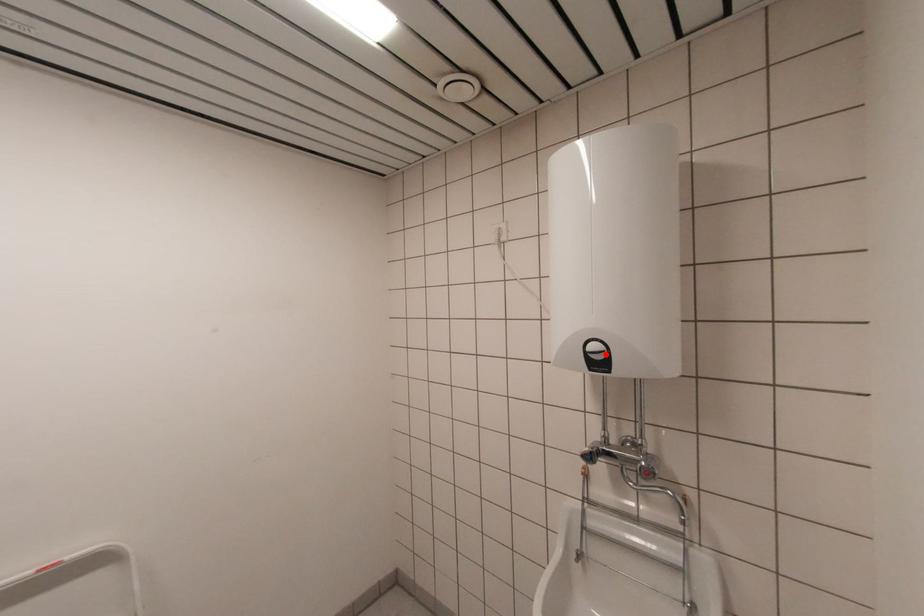
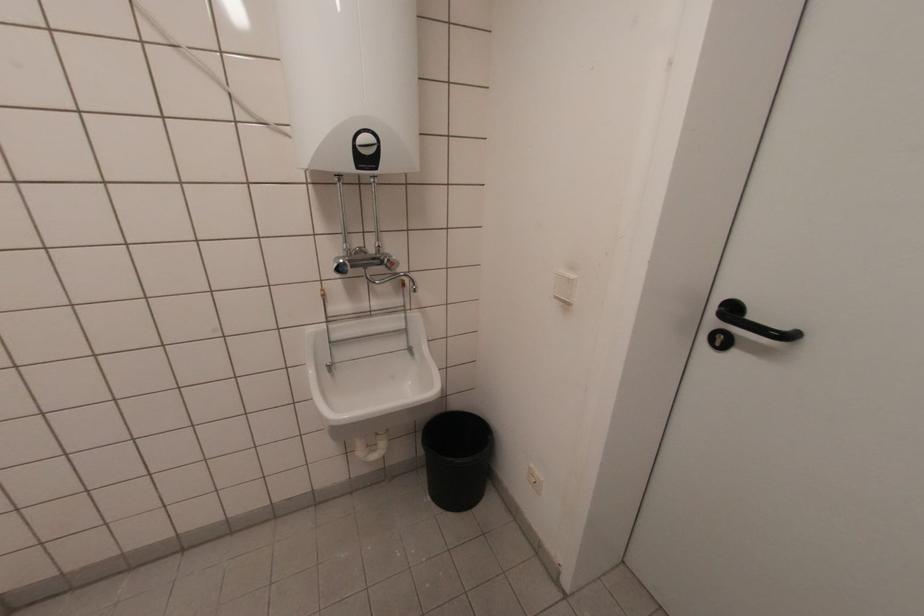
Question: I am providing you with two images of the same scene from different viewpoints. A red point is marked on the first image. Can you still see the location of the red point in image 2?

Choices:
 (A) Yes
 (B) No

Answer: (A)